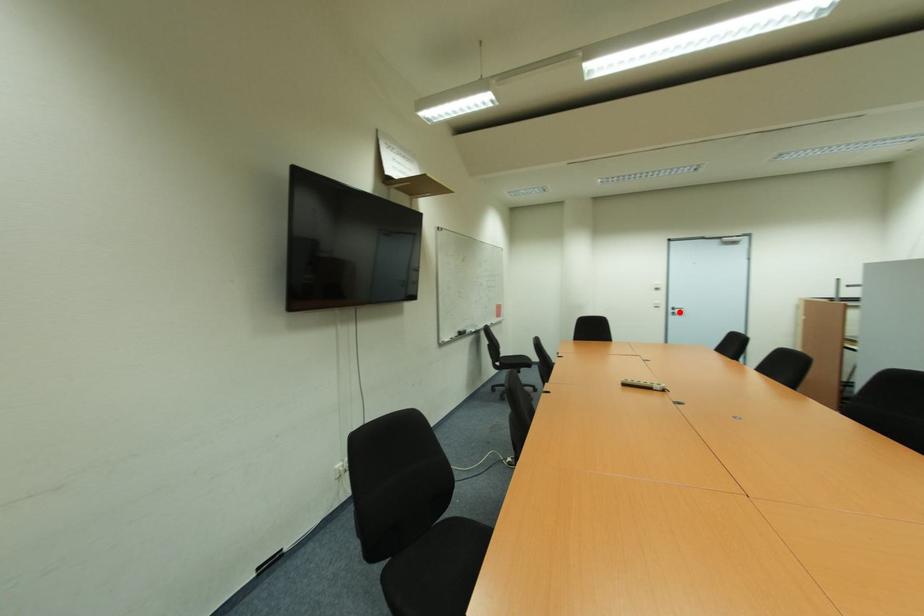
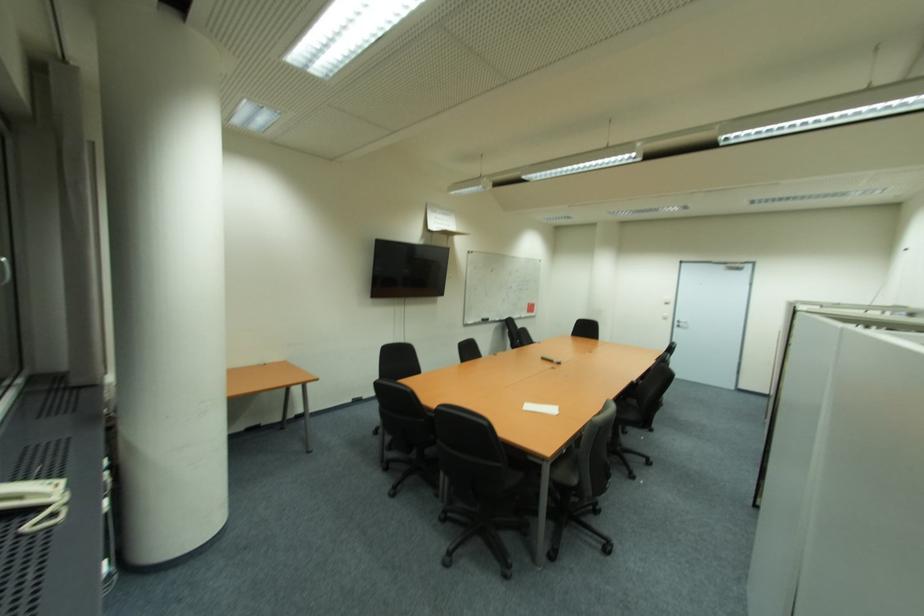
Where in the second image is the point corresponding to the highlighted location from the first image?

(686, 325)